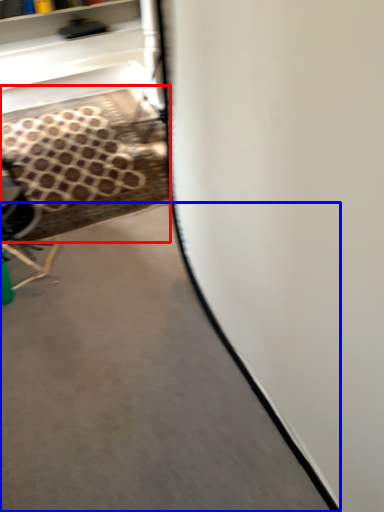
Question: Which object is further to the camera taking this photo, stair (highlighted by a red box) or concrete (highlighted by a blue box)?

Choices:
 (A) stair
 (B) concrete

Answer: (A)